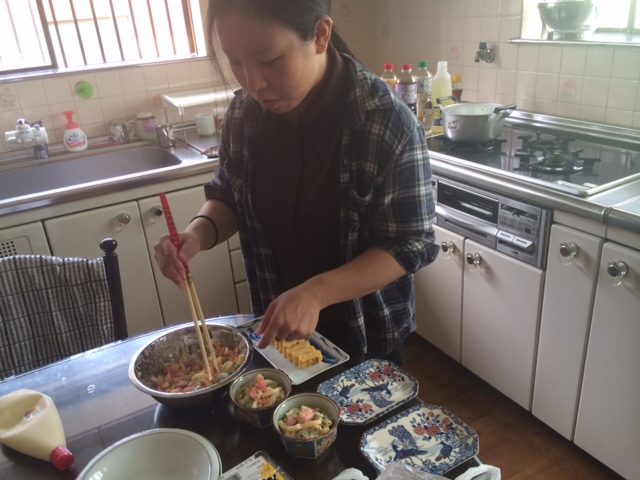
The width and height of the screenshot is (640, 480). Identify the location of sink. (61, 168).